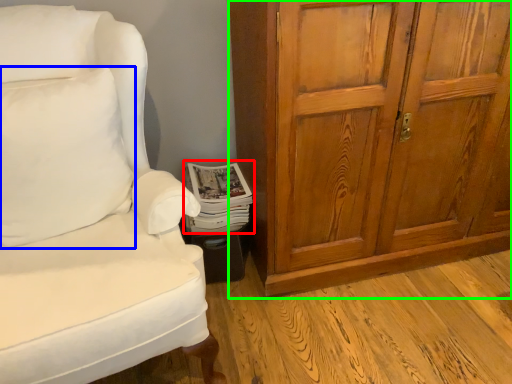
Question: Which is nearer to the magazine (highlighted by a red box)? pillow (highlighted by a blue box) or cabinetry (highlighted by a green box).

Choices:
 (A) pillow
 (B) cabinetry

Answer: (A)